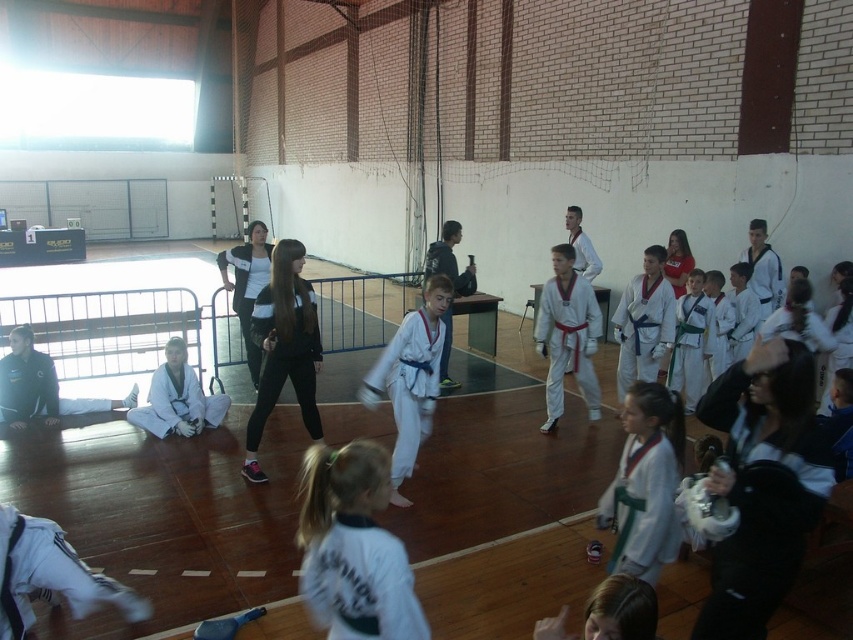
Question: Which object appears farthest from the camera in this image?

Choices:
 (A) black matte jacket at center
 (B) white fabric karate uniform at center

Answer: (A)

Question: Does white fabric karate uniform at center appear under black matte jacket at center?

Choices:
 (A) yes
 (B) no

Answer: (A)

Question: Which point is closer to the camera?

Choices:
 (A) white fabric karate uniform at center
 (B) white karate uniform at center

Answer: (A)

Question: Which object is farther from the camera taking this photo?

Choices:
 (A) black matte jacket at center
 (B) white fabric karate uniform at center
 (C) white karate uniform at center

Answer: (A)

Question: Is white fabric karate uniform at center below black matte jacket at center?

Choices:
 (A) yes
 (B) no

Answer: (A)

Question: Is black matte jacket at center in front of white karate uniform at center?

Choices:
 (A) yes
 (B) no

Answer: (B)